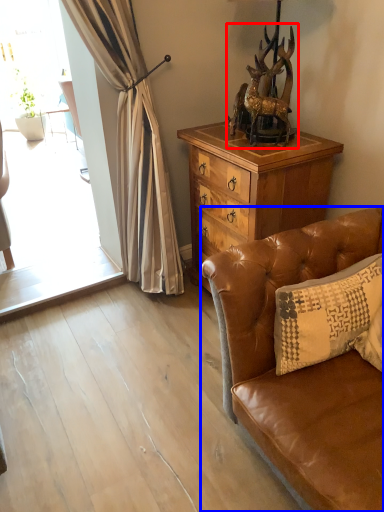
Question: Which object is closer to the camera taking this photo, animal (highlighted by a red box) or studio couch (highlighted by a blue box)?

Choices:
 (A) animal
 (B) studio couch

Answer: (B)